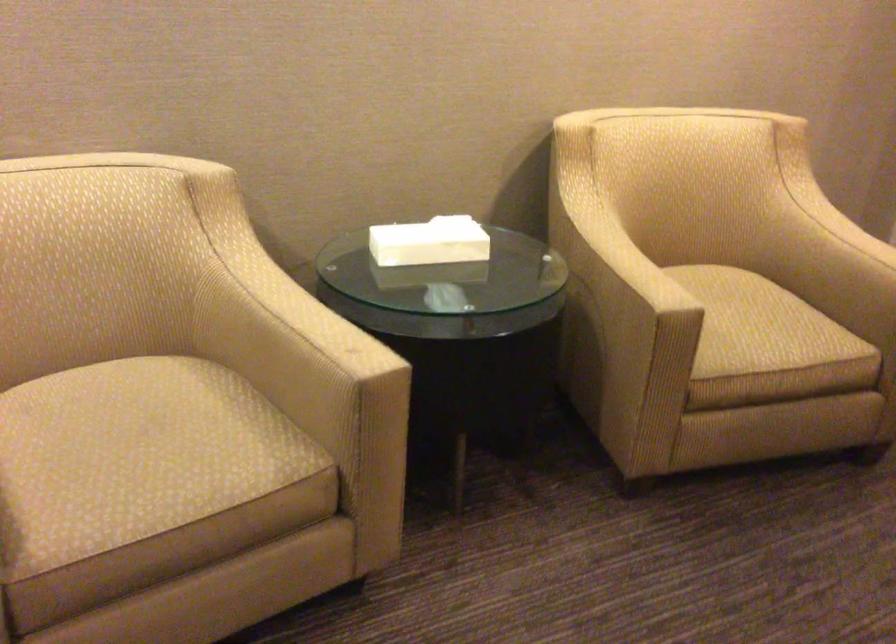
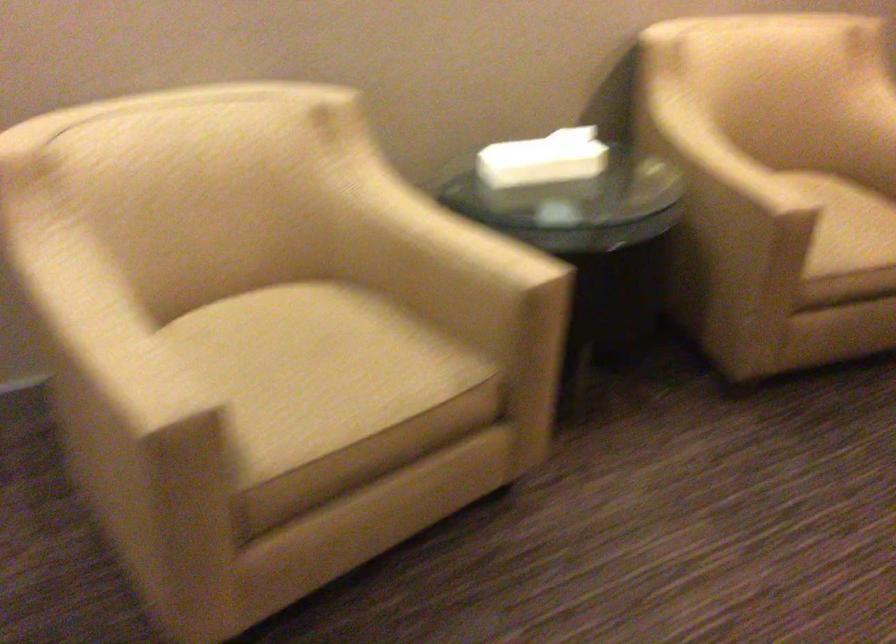
Locate, in the second image, the point that corresponds to [427,242] in the first image.

(543, 158)